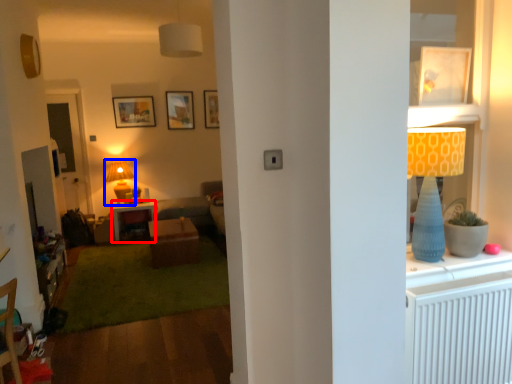
Question: Which object appears closest to the camera in this image, desk (highlighted by a red box) or lamp (highlighted by a blue box)?

Choices:
 (A) desk
 (B) lamp

Answer: (A)